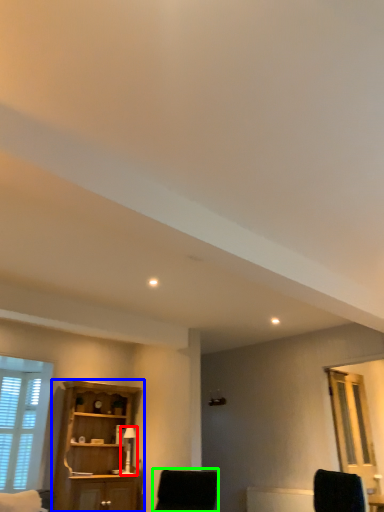
Question: Which object is the closest to the table lamp (highlighted by a red box)? Choose among these: cupboard (highlighted by a blue box) or chair (highlighted by a green box).

Choices:
 (A) cupboard
 (B) chair

Answer: (A)